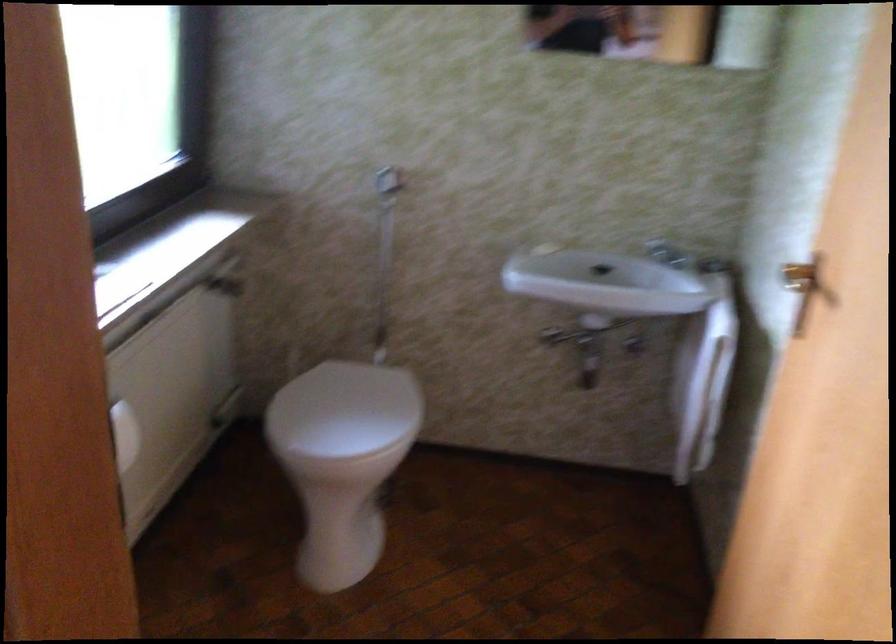
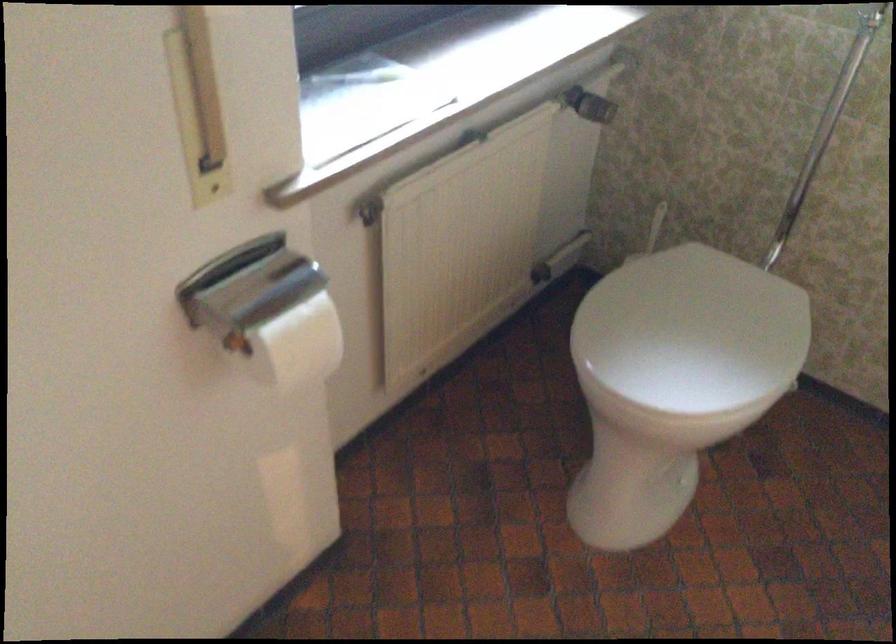
Find the pixel in the second image that matches (x=355, y=413) in the first image.

(692, 330)